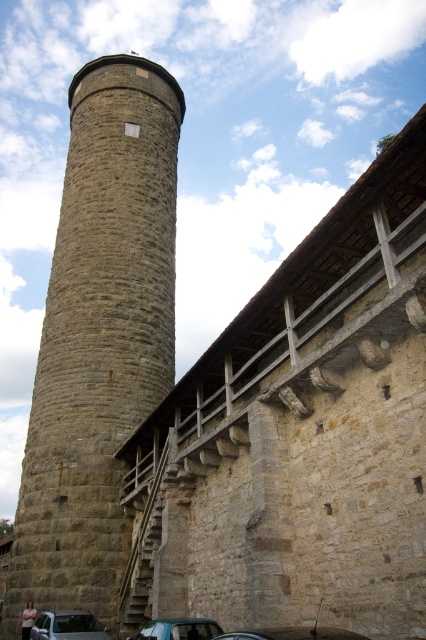
Describe the element at coordinates (178, 628) in the screenshot. I see `metallic blue car at lower center` at that location.

Is metallic blue car at lower center below metallic silver car at lower center?

Yes, metallic blue car at lower center is below metallic silver car at lower center.

Which is in front, point (152, 630) or point (256, 637)?

Positioned in front is point (256, 637).

Where is `metallic blue car at lower center`? This screenshot has height=640, width=426. metallic blue car at lower center is located at coordinates (178, 628).

Is metallic silver car at lower left positioned before metallic blue car at lower center?

No, metallic silver car at lower left is behind metallic blue car at lower center.

Which is in front, point (40, 632) or point (206, 627)?

Positioned in front is point (206, 627).

The height and width of the screenshot is (640, 426). I want to click on metallic silver car at lower left, so click(68, 625).

Can you confirm if stone water tower at center is positioned to the left of metallic blue car at lower center?

Indeed, stone water tower at center is positioned on the left side of metallic blue car at lower center.

Which is more to the right, stone water tower at center or metallic blue car at lower center?

Positioned to the right is metallic blue car at lower center.

The image size is (426, 640). Find the location of `stone water tower at center`. stone water tower at center is located at coordinates (98, 336).

This screenshot has height=640, width=426. Identify the location of stone water tower at center. (98, 336).